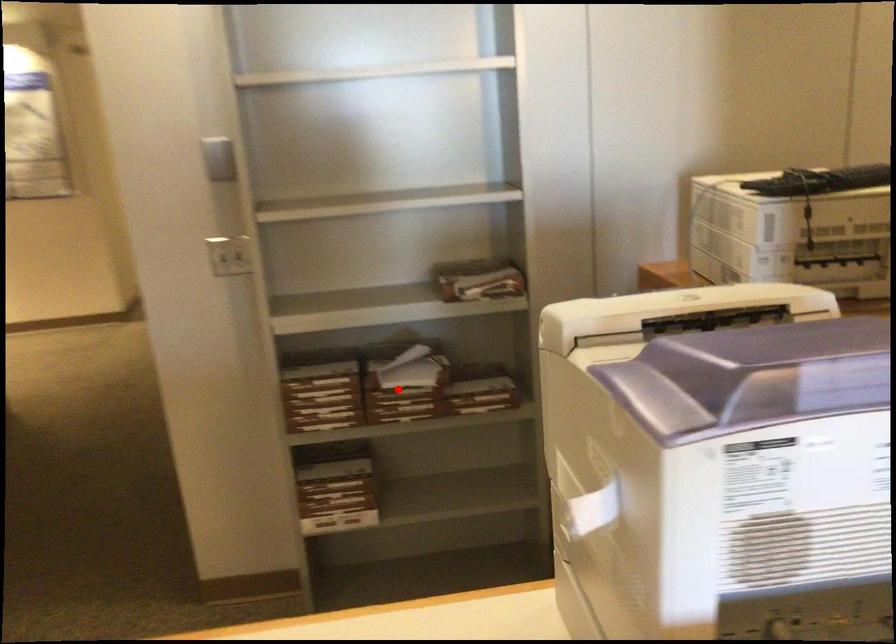
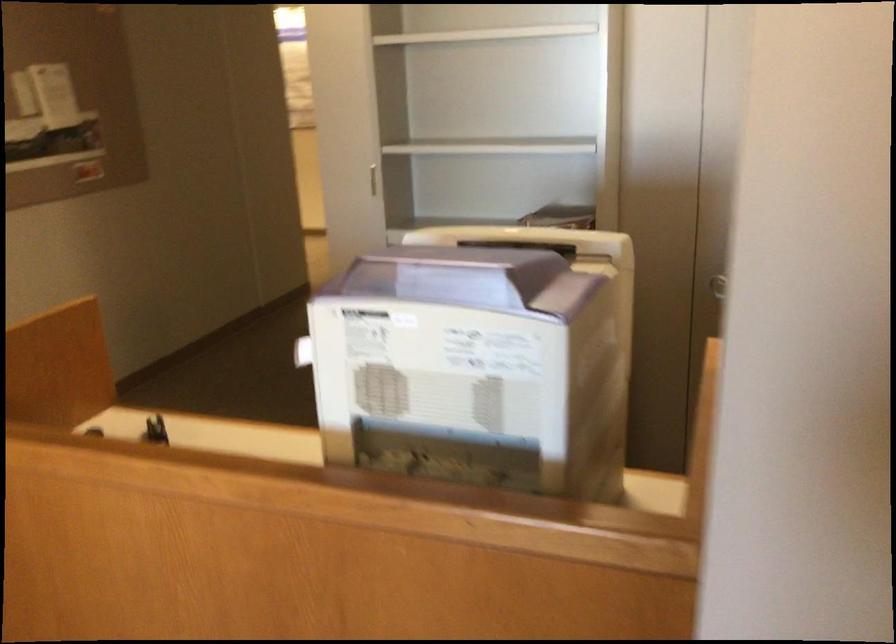
Question: I am providing you with two images of the same scene from different viewpoints. A red point is marked on the first image. Is the red point's position out of view in image 2?

Choices:
 (A) Yes
 (B) No

Answer: (A)